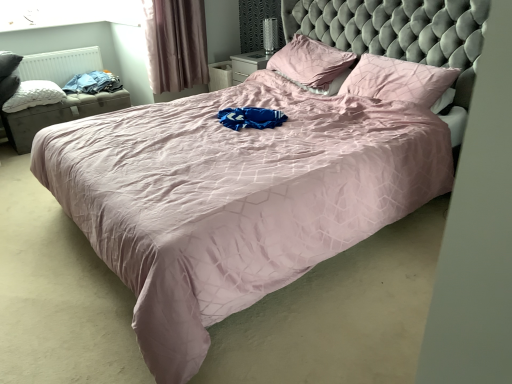
Question: Is pink fabric curtain at upper left positioned in front of blue cotton shirt at left?

Choices:
 (A) no
 (B) yes

Answer: (B)

Question: Is pink fabric curtain at upper left completely or partially outside of blue cotton shirt at left?

Choices:
 (A) no
 (B) yes

Answer: (B)

Question: From a real-world perspective, is pink fabric curtain at upper left below blue cotton shirt at left?

Choices:
 (A) yes
 (B) no

Answer: (B)

Question: Can you confirm if pink fabric curtain at upper left is thinner than blue cotton shirt at left?

Choices:
 (A) yes
 (B) no

Answer: (A)

Question: Is pink fabric curtain at upper left at the right side of blue cotton shirt at left?

Choices:
 (A) yes
 (B) no

Answer: (A)

Question: In terms of size, does pink fabric pillow at center, positioned as the second pillow in right-to-left order, appear bigger or smaller than pink fabric curtain at upper left?

Choices:
 (A) big
 (B) small

Answer: (A)

Question: From the image's perspective, is pink fabric pillow at center, arranged as the 2th pillow when viewed from the left, located above or below pink fabric curtain at upper left?

Choices:
 (A) above
 (B) below

Answer: (B)

Question: Relative to pink fabric curtain at upper left, is pink fabric pillow at center, arranged as the 2th pillow when viewed from the left, in front or behind?

Choices:
 (A) front
 (B) behind

Answer: (A)

Question: Would you say pink fabric pillow at center, arranged as the 2th pillow when viewed from the left, is inside or outside pink fabric curtain at upper left?

Choices:
 (A) outside
 (B) inside

Answer: (A)

Question: Choose the correct answer: Is pink fabric pillow at center, positioned as the second pillow in right-to-left order, inside white matte radiator at left or outside it?

Choices:
 (A) inside
 (B) outside

Answer: (B)

Question: Considering their positions, is pink fabric pillow at center, arranged as the 2th pillow when viewed from the left, located in front of or behind white matte radiator at left?

Choices:
 (A) behind
 (B) front

Answer: (B)

Question: Considering the positions of pink fabric pillow at center, arranged as the 2th pillow when viewed from the left, and white matte radiator at left in the image, is pink fabric pillow at center, arranged as the 2th pillow when viewed from the left, wider or thinner than white matte radiator at left?

Choices:
 (A) wide
 (B) thin

Answer: (A)

Question: From the image's perspective, is pink fabric pillow at center, positioned as the second pillow in right-to-left order, above or below white matte radiator at left?

Choices:
 (A) below
 (B) above

Answer: (A)

Question: Is pink fabric curtain at upper left inside or outside of white matte radiator at left?

Choices:
 (A) inside
 (B) outside

Answer: (B)

Question: Based on their sizes in the image, would you say pink fabric curtain at upper left is bigger or smaller than white matte radiator at left?

Choices:
 (A) big
 (B) small

Answer: (A)